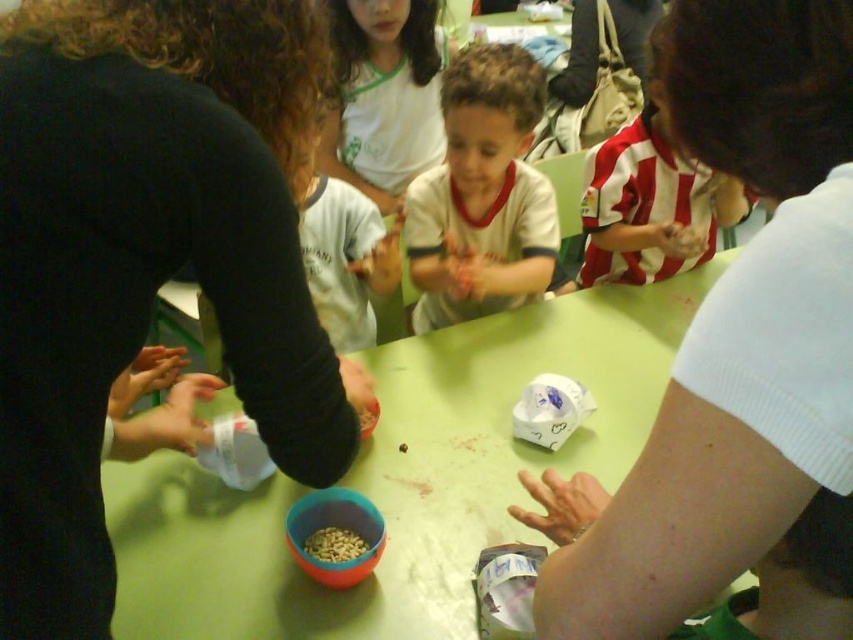
Question: Does green matte table at center appear on the left side of striped jersey at center?

Choices:
 (A) yes
 (B) no

Answer: (A)

Question: Is white matte shirt at upper right in front of white cotton shirt at upper center?

Choices:
 (A) yes
 (B) no

Answer: (A)

Question: Which of the following is the closest to the observer?

Choices:
 (A) white matte shirt at center
 (B) white matte shirt at upper right
 (C) striped jersey at center
 (D) light brown matte nuts at center

Answer: (B)

Question: Is white matte shirt at upper right smaller than white matte shirt at center?

Choices:
 (A) no
 (B) yes

Answer: (B)

Question: Which is farther from the white cotton shirt at upper center?

Choices:
 (A) green matte table at center
 (B) white matte shirt at center
 (C) light brown matte nuts at center
 (D) white matte shirt at upper right

Answer: (D)

Question: Considering the real-world distances, which object is closest to the light brown matte nuts at center?

Choices:
 (A) black matte shirt at left
 (B) striped jersey at center

Answer: (A)